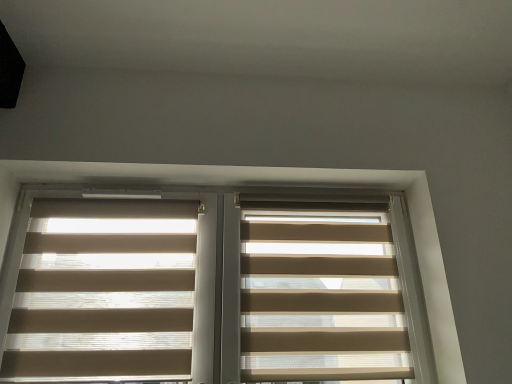
Question: Can you see beige translucent blinds at center touching beige fabric blinds at center, the first window blind in the right-to-left sequence?

Choices:
 (A) no
 (B) yes

Answer: (A)

Question: Is beige translucent blinds at center not inside beige fabric blinds at center, marked as the 2th window blind in a left-to-right arrangement?

Choices:
 (A) no
 (B) yes

Answer: (B)

Question: Is the position of beige translucent blinds at center less distant than that of beige fabric blinds at center, the first window blind in the right-to-left sequence?

Choices:
 (A) no
 (B) yes

Answer: (B)

Question: From a real-world perspective, does beige translucent blinds at center stand above beige fabric blinds at center, the first window blind in the right-to-left sequence?

Choices:
 (A) yes
 (B) no

Answer: (A)

Question: From a real-world perspective, is beige translucent blinds at center beneath beige fabric blinds at center, the first window blind in the right-to-left sequence?

Choices:
 (A) no
 (B) yes

Answer: (A)

Question: From the image's perspective, is beige translucent blinds at center located above or below beige translucent blinds at left, positioned as the 1th window blind in left-to-right order?

Choices:
 (A) below
 (B) above

Answer: (B)

Question: Would you say beige translucent blinds at center is inside or outside beige translucent blinds at left, acting as the second window blind starting from the right?

Choices:
 (A) outside
 (B) inside

Answer: (A)

Question: Based on their sizes in the image, would you say beige translucent blinds at center is bigger or smaller than beige translucent blinds at left, acting as the second window blind starting from the right?

Choices:
 (A) small
 (B) big

Answer: (B)

Question: Considering the positions of beige translucent blinds at center and beige translucent blinds at left, positioned as the 1th window blind in left-to-right order, in the image, is beige translucent blinds at center taller or shorter than beige translucent blinds at left, positioned as the 1th window blind in left-to-right order,?

Choices:
 (A) tall
 (B) short

Answer: (A)

Question: Considering the positions of beige fabric blinds at center, the first window blind in the right-to-left sequence, and beige translucent blinds at left, acting as the second window blind starting from the right, in the image, is beige fabric blinds at center, the first window blind in the right-to-left sequence, wider or thinner than beige translucent blinds at left, acting as the second window blind starting from the right,?

Choices:
 (A) thin
 (B) wide

Answer: (B)

Question: Do you think beige fabric blinds at center, marked as the 2th window blind in a left-to-right arrangement, is within beige translucent blinds at left, positioned as the 1th window blind in left-to-right order, or outside of it?

Choices:
 (A) outside
 (B) inside

Answer: (A)

Question: Does point (350, 324) appear closer or farther from the camera than point (83, 324)?

Choices:
 (A) closer
 (B) farther

Answer: (B)

Question: In terms of height, does beige fabric blinds at center, marked as the 2th window blind in a left-to-right arrangement, look taller or shorter compared to beige translucent blinds at left, acting as the second window blind starting from the right?

Choices:
 (A) tall
 (B) short

Answer: (A)

Question: From the image's perspective, is beige fabric blinds at center, marked as the 2th window blind in a left-to-right arrangement, above or below beige translucent blinds at center?

Choices:
 (A) above
 (B) below

Answer: (B)

Question: From a real-world perspective, is beige fabric blinds at center, marked as the 2th window blind in a left-to-right arrangement, positioned above or below beige translucent blinds at center?

Choices:
 (A) below
 (B) above

Answer: (A)